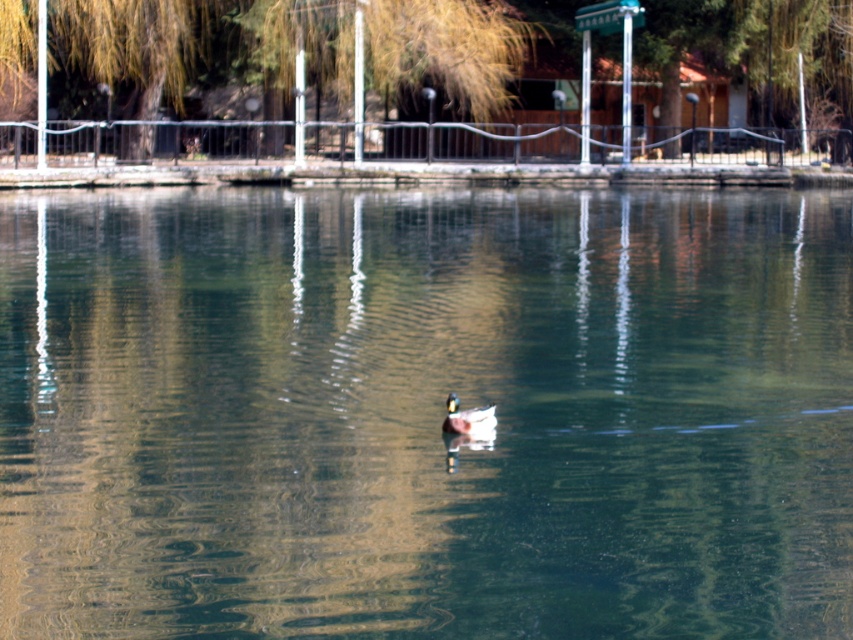
You are standing on the walkway and see the clear water at duck center and the green glossy duck at center. Which object is closer to the water surface?

The clear water at duck center is located above the green glossy duck at center, so the clear water at duck center is closer to the water surface.

You are standing on the walkway and want to observe the duck and the water. Which object, the clear water at duck center or the green glossy duck at center, appears closer to you based on their relative sizes?

The clear water at duck center appears taller than the green glossy duck at center, so it is closer to you.